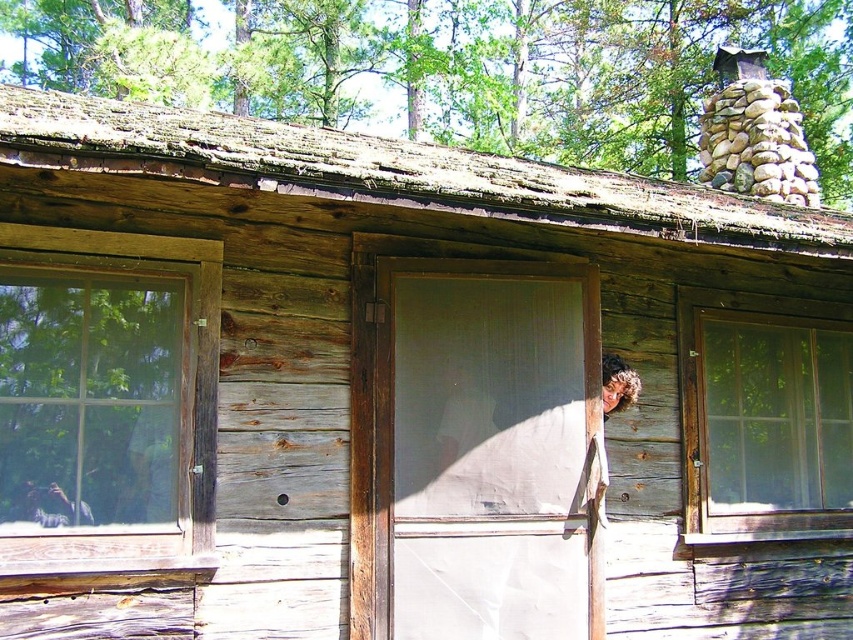
Question: Based on their relative distances, which object is nearer to the clear glass window at right?

Choices:
 (A) weathered wood roof at upper center
 (B) clear glass window at left

Answer: (B)

Question: Does weathered wood roof at upper center lie in front of clear glass window at right?

Choices:
 (A) yes
 (B) no

Answer: (A)

Question: Does weathered wood roof at upper center appear on the left side of clear glass window at right?

Choices:
 (A) yes
 (B) no

Answer: (A)

Question: From the image, what is the correct spatial relationship of clear glass window at left in relation to clear glass window at right?

Choices:
 (A) right
 (B) left

Answer: (B)

Question: Which of the following is the closest to the observer?

Choices:
 (A) (491, 209)
 (B) (824, 397)

Answer: (A)

Question: Based on their relative distances, which object is nearer to the clear glass window at right?

Choices:
 (A) weathered wood roof at upper center
 (B) clear glass window at left

Answer: (B)